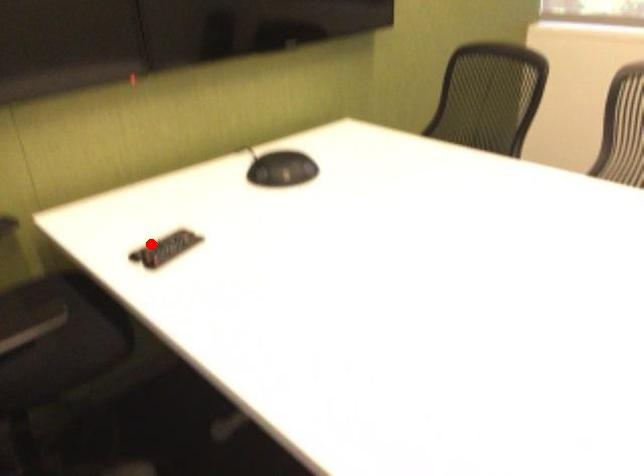
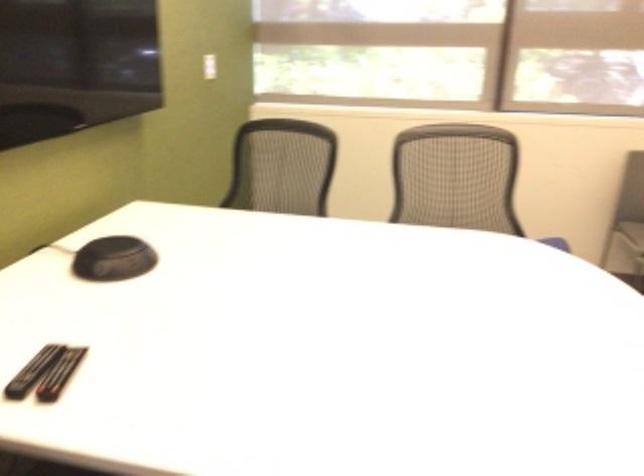
Question: I am providing you with two images of the same scene from different viewpoints. In image1, a red point is highlighted. Considering the same 3D point in image2, which of the following is correct?

Choices:
 (A) It is closer
 (B) It is farther

Answer: (A)